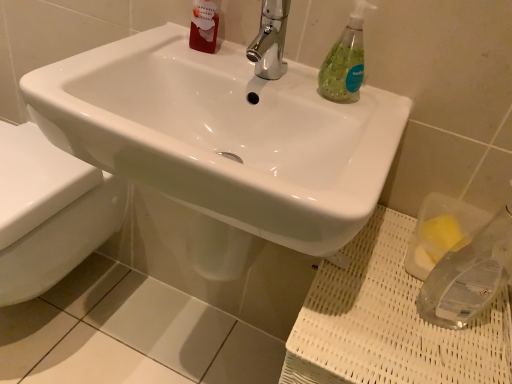
The image size is (512, 384). I want to click on empty space that is in between chrome metallic faucet at upper center and translucent red liquid at upper left, so click(x=227, y=67).